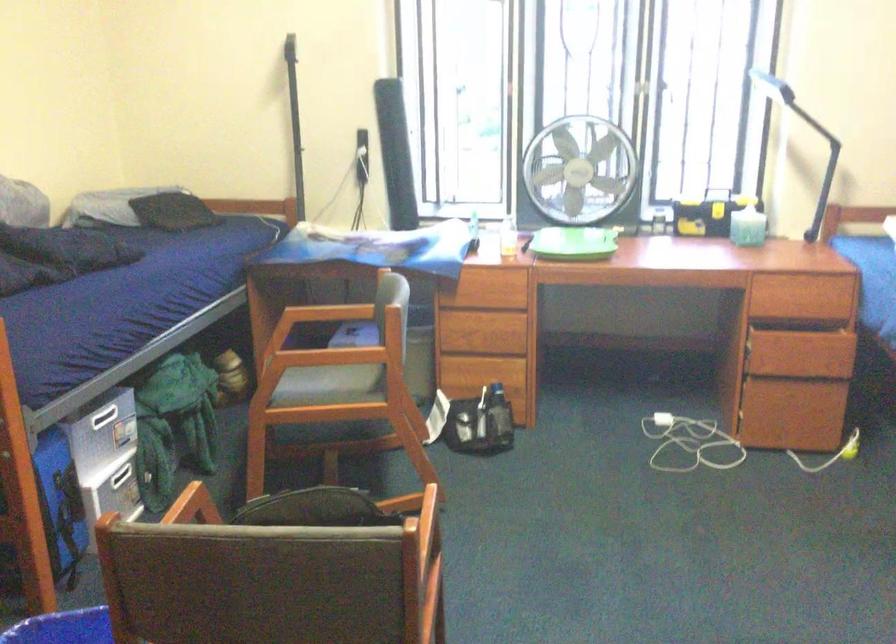
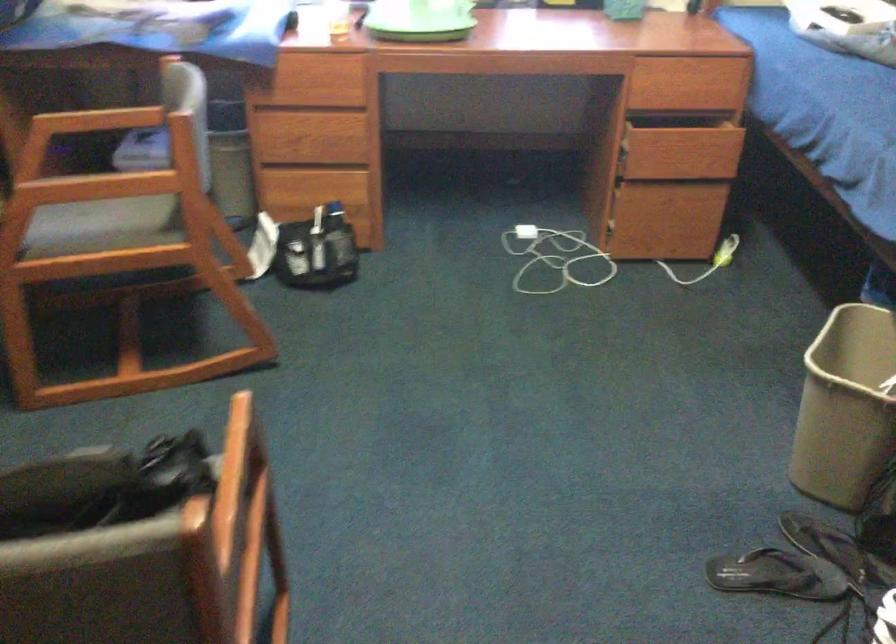
Question: Which direction would the cameraman need to move to produce the second image? Reply with the corresponding letter.

Choices:
 (A) Left
 (B) Right
 (C) Forward
 (D) Backward

Answer: (C)